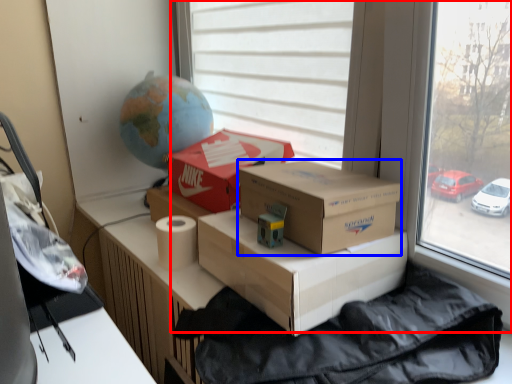
Question: Which object is closer to the camera taking this photo, window (highlighted by a red box) or box (highlighted by a blue box)?

Choices:
 (A) window
 (B) box

Answer: (A)